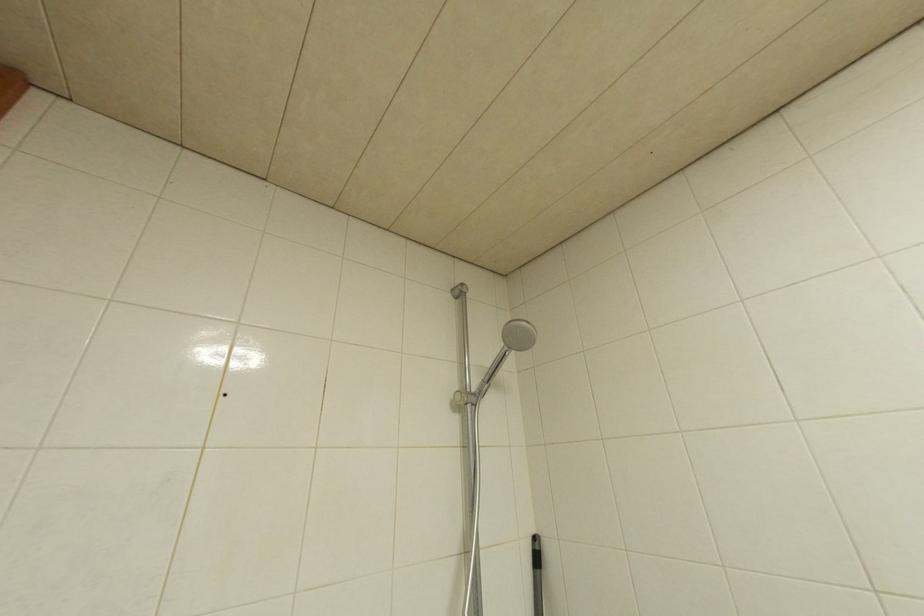
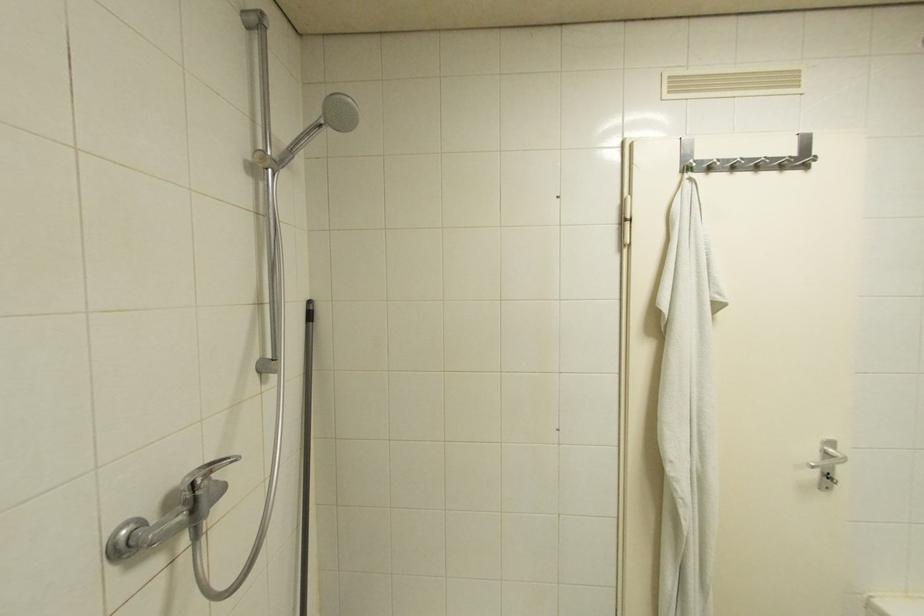
First-person continuous shooting, in which direction is the camera rotating?

The camera rotated toward right-down.